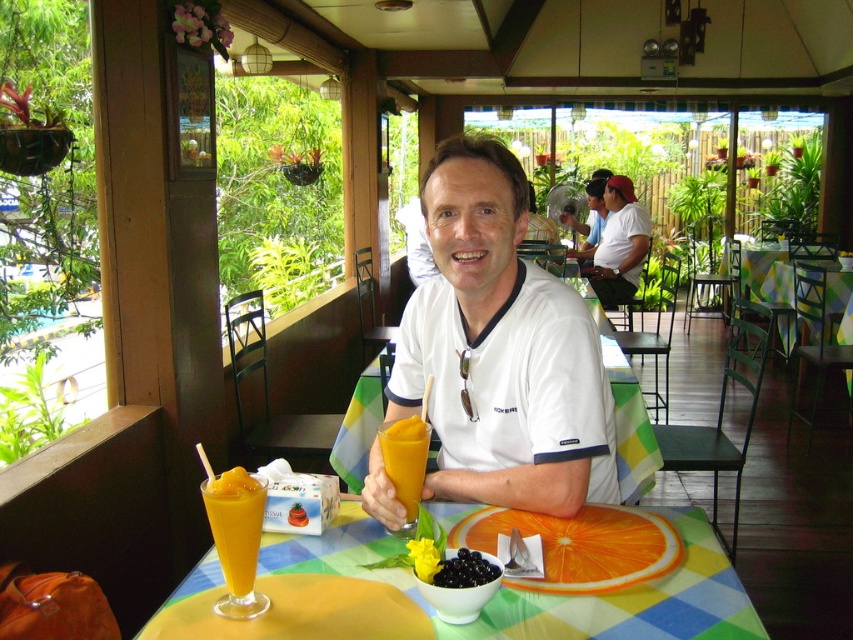
Question: Which point is closer to the camera?

Choices:
 (A) white smooth shirt at center
 (B) white cotton shirt at center
 (C) yellow smoothie at center

Answer: (C)

Question: Estimate the real-world distances between objects in this image. Which object is farther from the white smooth shirt at center?

Choices:
 (A) smooth orange smoothie at table center
 (B) yellow smoothie at center
 (C) multicolored fabric table at center

Answer: (C)

Question: Can you confirm if translucent glass table at center is smaller than white cotton shirt at center?

Choices:
 (A) yes
 (B) no

Answer: (A)

Question: Which is nearer to the black glossy bowl at lower center?

Choices:
 (A) multicolored fabric table at center
 (B) smooth orange smoothie at table center
 (C) translucent glass table at center

Answer: (C)

Question: Does white cotton shirt at center come behind multicolored fabric table at center?

Choices:
 (A) no
 (B) yes

Answer: (B)

Question: Does yellow smoothie at center have a smaller size compared to black glossy bowl at lower center?

Choices:
 (A) yes
 (B) no

Answer: (B)